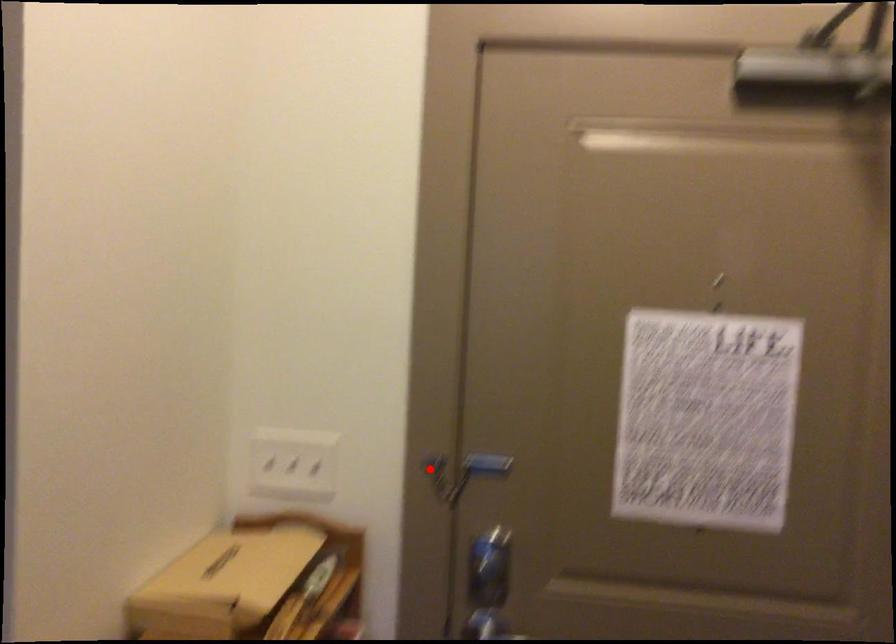
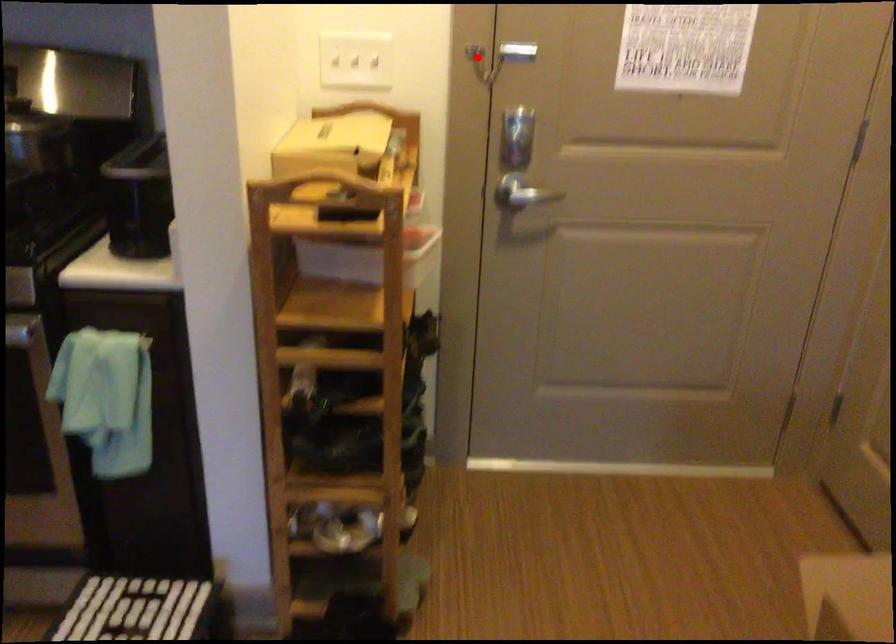
I am providing you with two images of the same scene from different viewpoints. A red point is marked on the first image and another point is marked on the second image. Are the points marked in image1 and image2 representing the same 3D position?

Yes